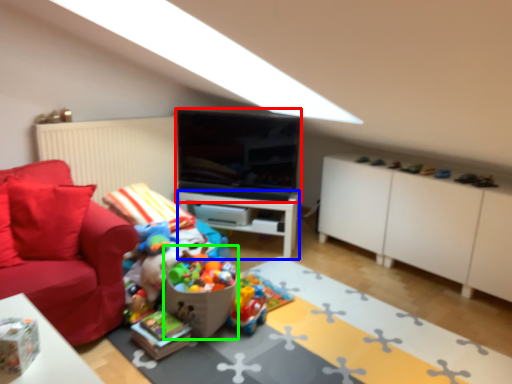
Question: Considering the real-world distances, which object is closest to television (highlighted by a red box)? table (highlighted by a blue box) or toy (highlighted by a green box).

Choices:
 (A) table
 (B) toy

Answer: (A)